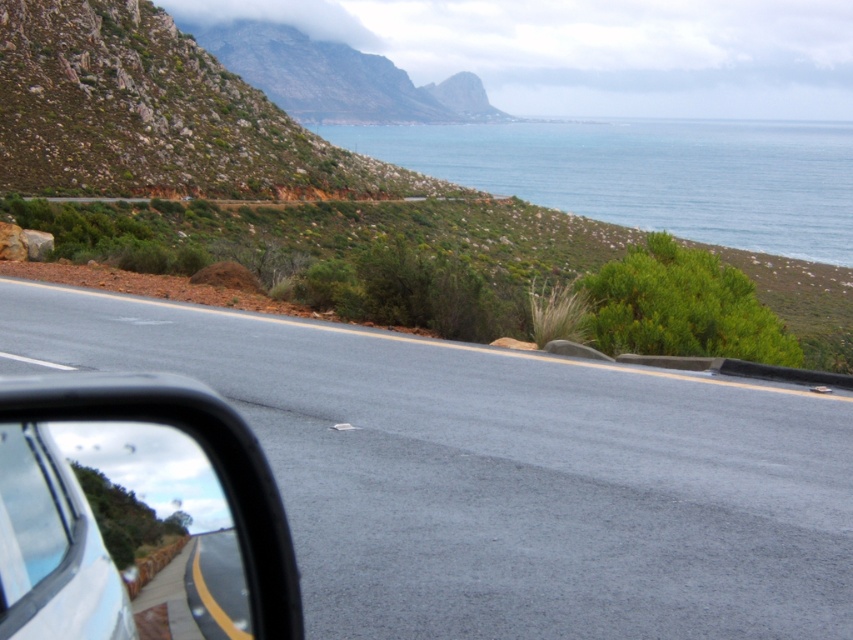
You are sitting in the driver seat of the car and looking through the side mirror. There are two points marked on the mirror reflection. The first point is at coordinate point (552, 131) and the second point is at coordinate point (62, 561). Which point is closer to you?

Point (62, 561) is closer to you because it is nearer to the camera compared to point (552, 131).

You are a passenger in the car and want to look at the blue water at upper right. Can you see it through the transparent glass car window at lower left?

The transparent glass car window at lower left is behind the blue water at upper right, so you cannot see the blue water at upper right through the transparent glass car window at lower left because the window is positioned behind the water in the scene.